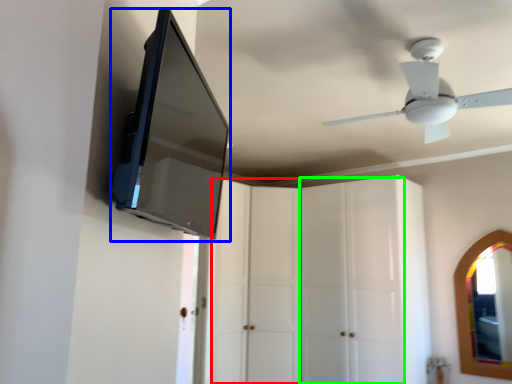
Question: Which object is positioned closest to glass door (highlighted by a red box)? Select from medicine cabinet (highlighted by a blue box) and glass door (highlighted by a green box).

Choices:
 (A) medicine cabinet
 (B) glass door

Answer: (B)